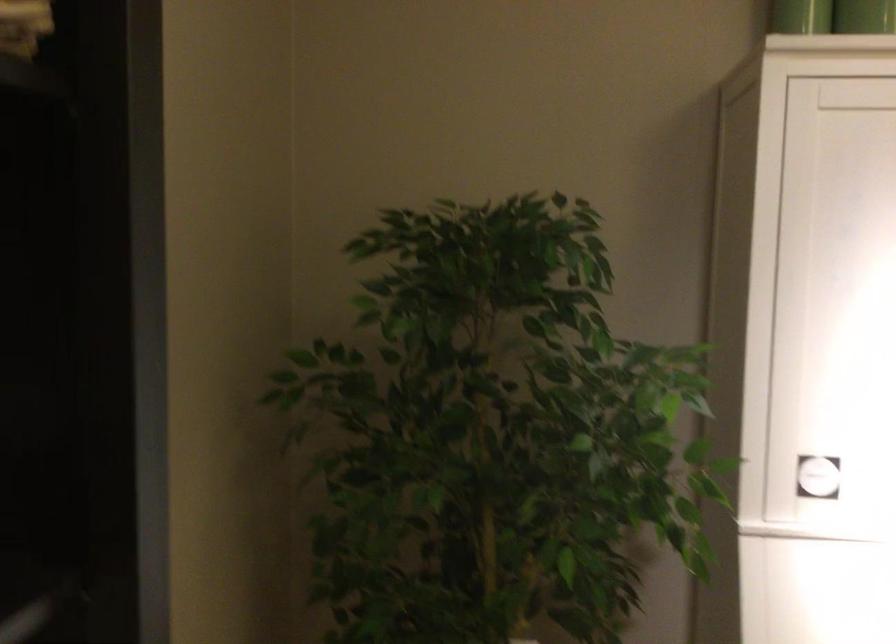
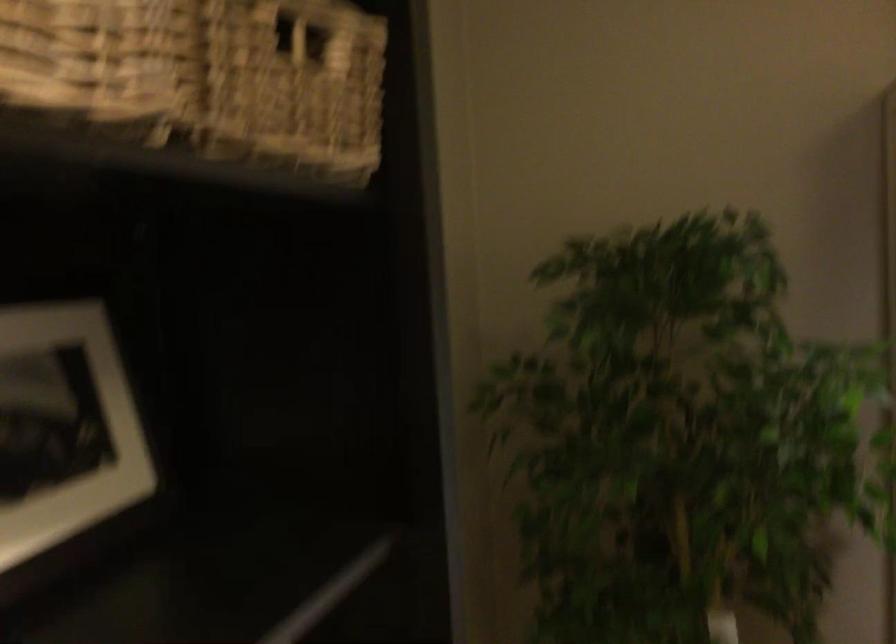
Question: How did the camera likely rotate?

Choices:
 (A) Left
 (B) Right
 (C) Up
 (D) Down

Answer: (A)